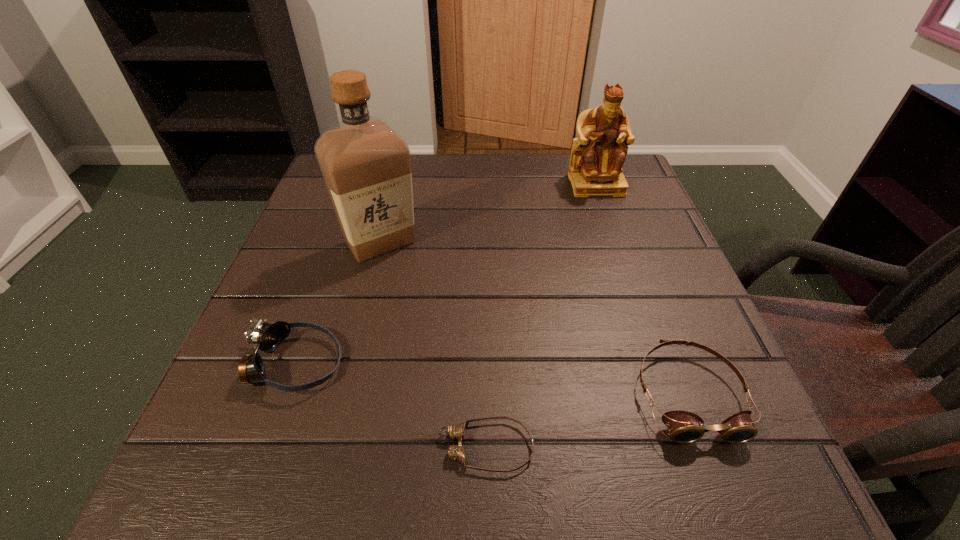
The height and width of the screenshot is (540, 960). Identify the location of goggles that stands as the second closest to the second tallest object. (456, 452).

Locate an element on the screen. The width and height of the screenshot is (960, 540). vacant area in the image that satisfies the following two spatial constraints: 1. on the front-facing side of the figurine; 2. on the front lenses and sides of the shortest object is located at coordinates (687, 447).

Where is `free region that satisfies the following two spatial constraints: 1. through the lenses of the rightmost goggles; 2. on the front lenses and sides of the shortest object`? free region that satisfies the following two spatial constraints: 1. through the lenses of the rightmost goggles; 2. on the front lenses and sides of the shortest object is located at coordinates (708, 447).

This screenshot has width=960, height=540. What are the coordinates of `vacant region that satisfies the following two spatial constraints: 1. on the front-facing side of the tallest object; 2. through the lenses of the leftmost goggles` in the screenshot? It's located at click(349, 364).

Locate an element on the screen. blank area in the image that satisfies the following two spatial constraints: 1. on the front-facing side of the farthest object; 2. on the front lenses and sides of the second goggles from left to right is located at coordinates (687, 447).